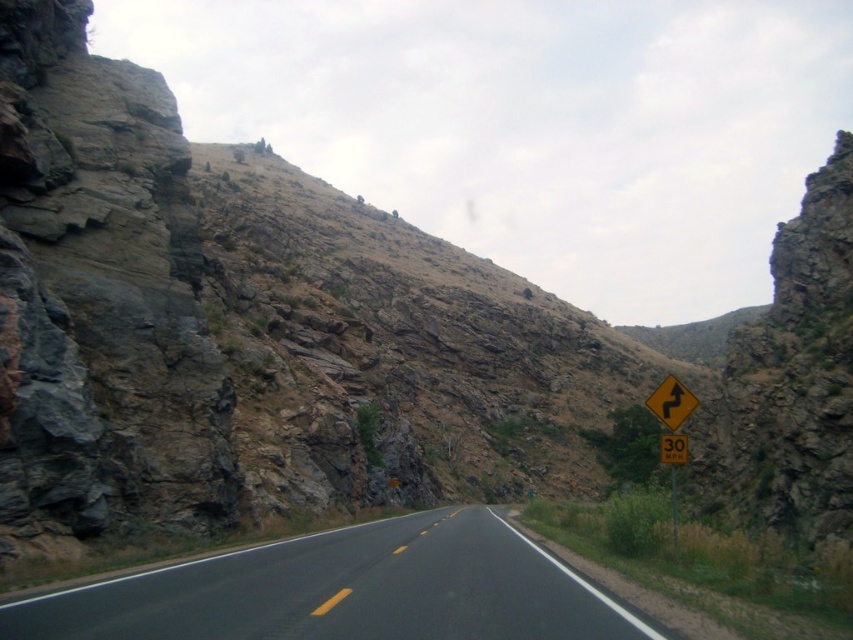
Question: Which object is positioned farthest from the black asphalt road at center?

Choices:
 (A) yellow reflective plastic at center
 (B) yellow reflective plastic at right
 (C) yellow plastic speed limit sign at center

Answer: (A)

Question: Which of the following is the closest to the observer?

Choices:
 (A) (689, 396)
 (B) (672, 456)
 (C) (204, 572)
 (D) (657, 388)

Answer: (C)

Question: Does yellow reflective plastic at center come behind yellow plastic speed limit sign at center?

Choices:
 (A) no
 (B) yes

Answer: (B)

Question: Based on their relative distances, which object is farther from the yellow reflective plastic at center?

Choices:
 (A) black asphalt road at center
 (B) yellow reflective plastic at right
 (C) yellow plastic speed limit sign at center

Answer: (C)

Question: Is yellow reflective plastic at center positioned in front of yellow plastic speed limit sign at center?

Choices:
 (A) yes
 (B) no

Answer: (B)

Question: Can you confirm if black asphalt road at center is smaller than yellow reflective plastic at center?

Choices:
 (A) yes
 (B) no

Answer: (A)